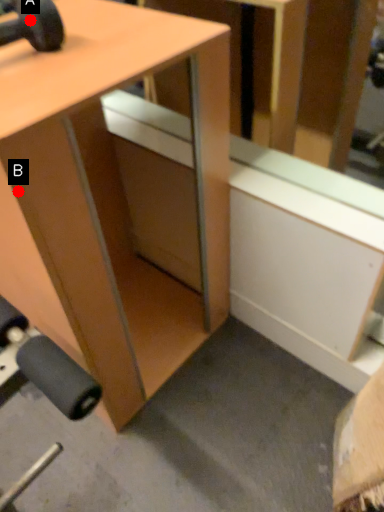
Question: Two points are circled on the image, labeled by A and B beside each circle. Which of the following is the farthest from the observer?

Choices:
 (A) A is further
 (B) B is further

Answer: (A)